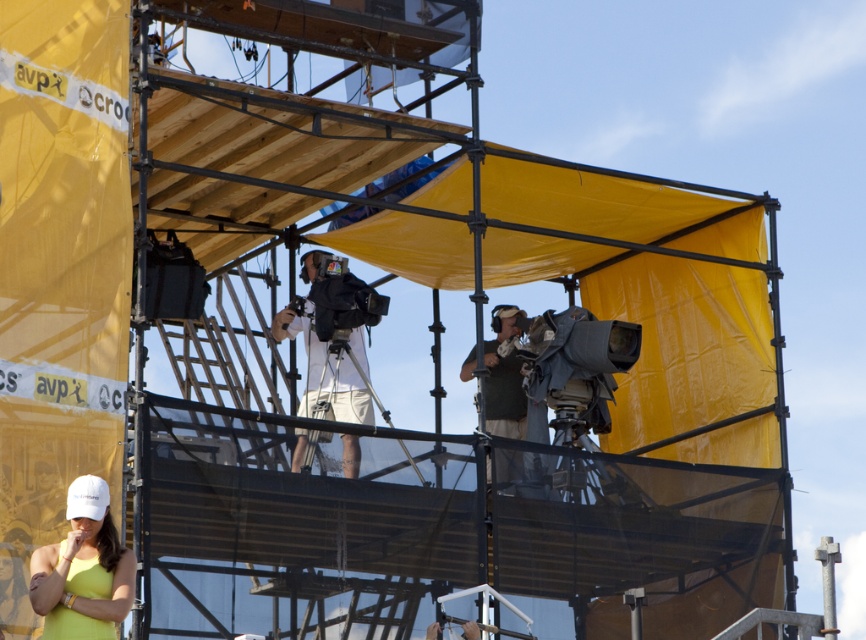
Question: Which is farther from the white matte camera at center?

Choices:
 (A) green fabric vest at center
 (B) white matte baseball cap at lower left

Answer: (B)

Question: Which object appears closest to the camera in this image?

Choices:
 (A) white matte camera at center
 (B) white matte baseball cap at lower left
 (C) green fabric vest at center

Answer: (B)

Question: Does white matte camera at center have a lesser width compared to green fabric vest at center?

Choices:
 (A) no
 (B) yes

Answer: (A)

Question: Does white matte baseball cap at lower left appear on the right side of green fabric vest at center?

Choices:
 (A) no
 (B) yes

Answer: (A)

Question: Which object is the closest to the white matte baseball cap at lower left?

Choices:
 (A) green fabric vest at center
 (B) white matte camera at center

Answer: (B)

Question: Observing the image, what is the correct spatial positioning of white matte camera at center in reference to green fabric vest at center?

Choices:
 (A) left
 (B) right

Answer: (A)